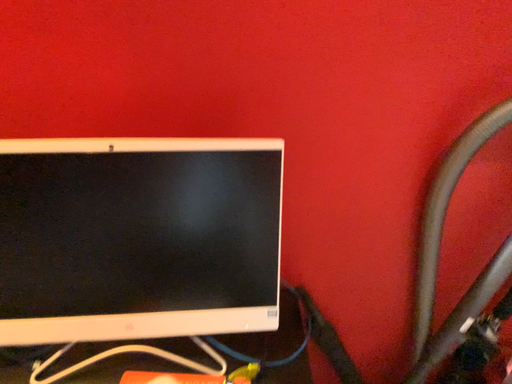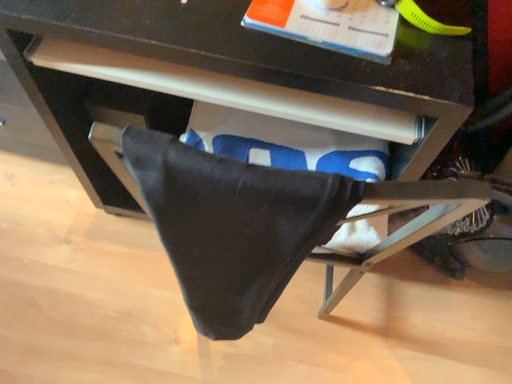
Question: How did the camera likely rotate when shooting the video?

Choices:
 (A) rotated left
 (B) rotated right

Answer: (A)